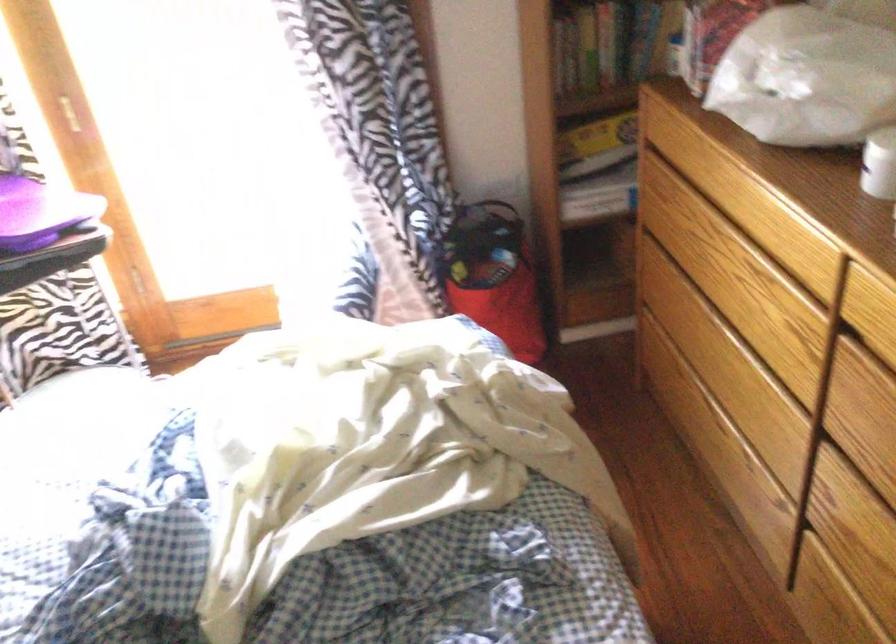
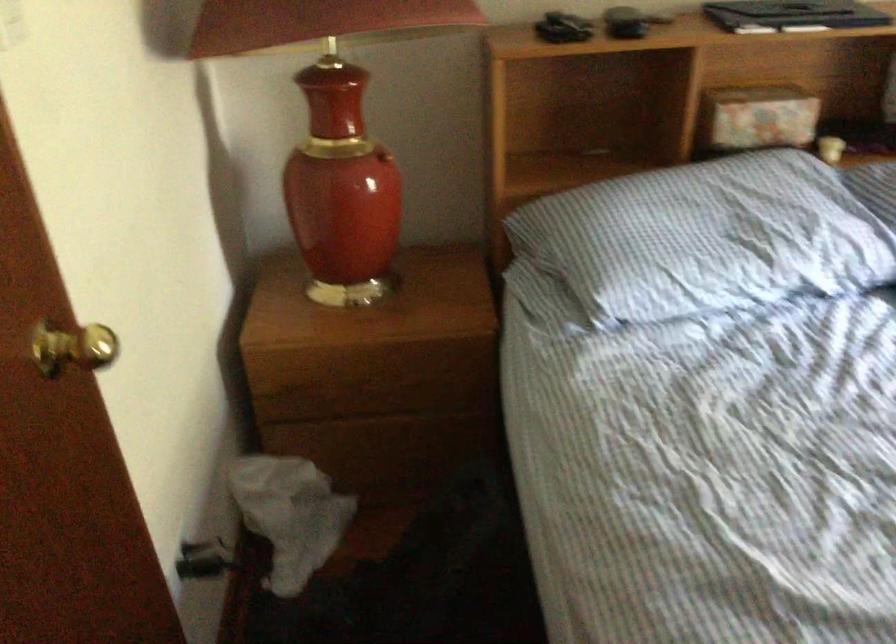
The images are taken continuously from a first-person perspective. In which direction is your viewpoint rotating?

The camera's rotation is toward left-down.